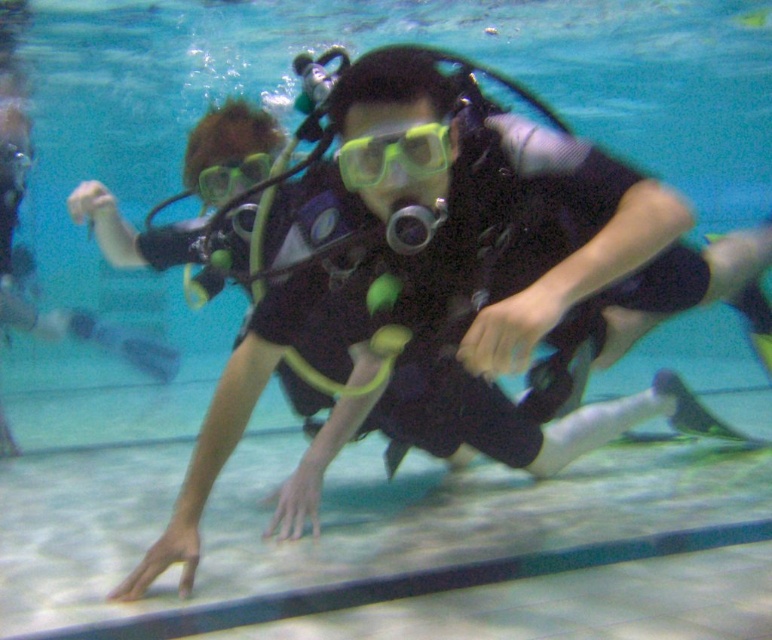
Question: From the image, what is the correct spatial relationship of yellow matte/glossy goggles at center in relation to green matte/glossy goggles at center?

Choices:
 (A) below
 (B) above

Answer: (A)

Question: Is yellow matte/glossy goggles at center to the right of green matte/glossy goggles at center from the viewer's perspective?

Choices:
 (A) yes
 (B) no

Answer: (A)

Question: Which of the following is the closest to the observer?

Choices:
 (A) yellow matte/glossy goggles at center
 (B) green matte/glossy goggles at center

Answer: (A)

Question: Which point is farther to the camera?

Choices:
 (A) yellow matte/glossy goggles at center
 (B) green matte/glossy goggles at center

Answer: (B)

Question: Is yellow matte/glossy goggles at center wider than green matte/glossy goggles at center?

Choices:
 (A) no
 (B) yes

Answer: (A)

Question: Among these points, which one is farthest from the camera?

Choices:
 (A) (425, 166)
 (B) (217, 200)

Answer: (B)